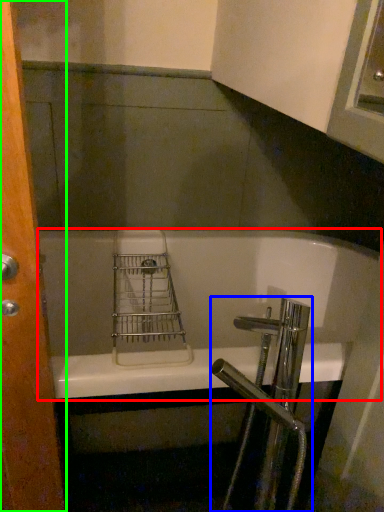
Question: Which is nearer to the bathtub (highlighted by a red box)? tap (highlighted by a blue box) or screen door (highlighted by a green box).

Choices:
 (A) tap
 (B) screen door

Answer: (A)